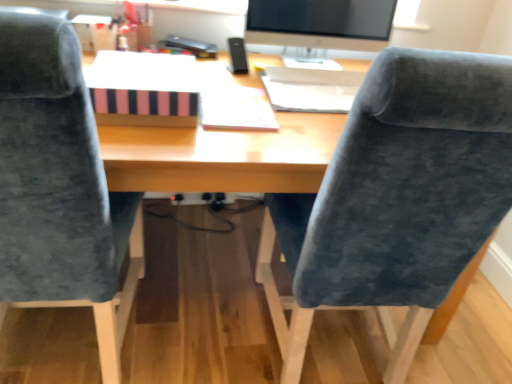
Question: Is satin black monitor at upper center facing towards pink striped paper at center, positioned as the first book in left-to-right order?

Choices:
 (A) yes
 (B) no

Answer: (B)

Question: Is satin black monitor at upper center far away from pink striped paper at center, positioned as the first book in left-to-right order?

Choices:
 (A) no
 (B) yes

Answer: (A)

Question: Is satin black monitor at upper center shorter than pink striped paper at center, positioned as the first book in left-to-right order?

Choices:
 (A) yes
 (B) no

Answer: (B)

Question: Does satin black monitor at upper center have a greater width compared to pink striped paper at center, positioned as the second book in right-to-left order?

Choices:
 (A) yes
 (B) no

Answer: (B)

Question: Is pink striped paper at center, positioned as the first book in left-to-right order, located within satin black monitor at upper center?

Choices:
 (A) no
 (B) yes

Answer: (A)

Question: In terms of width, does velvet blue chair at right, acting as the second chair starting from the left, look wider or thinner when compared to white paper at upper center, which ranks as the second book in left-to-right order?

Choices:
 (A) thin
 (B) wide

Answer: (B)

Question: Considering the positions of point (429, 89) and point (349, 97), is point (429, 89) closer or farther from the camera than point (349, 97)?

Choices:
 (A) farther
 (B) closer

Answer: (B)

Question: From a real-world perspective, is velvet blue chair at right, acting as the second chair starting from the left, positioned above or below white paper at upper center, positioned as the 1th book in right-to-left order?

Choices:
 (A) below
 (B) above

Answer: (A)

Question: Considering their positions, is velvet blue chair at right, which is the first chair from right to left, located in front of or behind white paper at upper center, positioned as the 1th book in right-to-left order?

Choices:
 (A) front
 (B) behind

Answer: (A)

Question: Considering the positions of velvet blue chair at left, which is counted as the first chair, starting from the left, and velvet blue chair at right, acting as the second chair starting from the left, in the image, is velvet blue chair at left, which is counted as the first chair, starting from the left, bigger or smaller than velvet blue chair at right, acting as the second chair starting from the left,?

Choices:
 (A) small
 (B) big

Answer: (B)

Question: In the image, is velvet blue chair at left, which is counted as the first chair, starting from the left, on the left side or the right side of velvet blue chair at right, which is the first chair from right to left?

Choices:
 (A) right
 (B) left

Answer: (B)

Question: Looking at their shapes, would you say velvet blue chair at left, which is counted as the 2th chair, starting from the right, is wider or thinner than velvet blue chair at right, which is the first chair from right to left?

Choices:
 (A) thin
 (B) wide

Answer: (A)

Question: Would you say velvet blue chair at left, which is counted as the first chair, starting from the left, is inside or outside velvet blue chair at right, which is the first chair from right to left?

Choices:
 (A) outside
 (B) inside

Answer: (A)

Question: In the image, is white paper at upper center, which ranks as the second book in left-to-right order, positioned in front of or behind velvet blue chair at left, which is counted as the 2th chair, starting from the right?

Choices:
 (A) front
 (B) behind

Answer: (B)

Question: From their relative heights in the image, would you say white paper at upper center, positioned as the 1th book in right-to-left order, is taller or shorter than velvet blue chair at left, which is counted as the 2th chair, starting from the right?

Choices:
 (A) tall
 (B) short

Answer: (B)